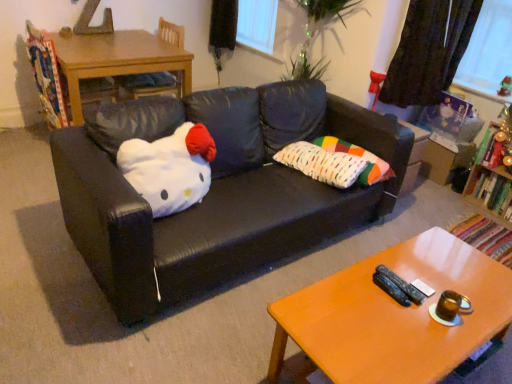
Question: Does orange wood coffee table at lower right have a larger size compared to dark fabric curtain at upper right?

Choices:
 (A) yes
 (B) no

Answer: (A)

Question: Is the position of orange wood coffee table at lower right more distant than that of dark fabric curtain at upper right?

Choices:
 (A) yes
 (B) no

Answer: (B)

Question: Is orange wood coffee table at lower right smaller than dark fabric curtain at upper right?

Choices:
 (A) no
 (B) yes

Answer: (A)

Question: Is orange wood coffee table at lower right not close to dark fabric curtain at upper right?

Choices:
 (A) no
 (B) yes

Answer: (B)

Question: Can you confirm if orange wood coffee table at lower right is taller than dark fabric curtain at upper right?

Choices:
 (A) no
 (B) yes

Answer: (A)

Question: Considering the relative sizes of orange wood coffee table at lower right and dark fabric curtain at upper right in the image provided, is orange wood coffee table at lower right shorter than dark fabric curtain at upper right?

Choices:
 (A) yes
 (B) no

Answer: (A)

Question: Would you say black leather couch at center is a long distance from wooden table at left?

Choices:
 (A) no
 (B) yes

Answer: (B)

Question: From a real-world perspective, is black leather couch at center physically below wooden table at left?

Choices:
 (A) yes
 (B) no

Answer: (B)

Question: Is the depth of black leather couch at center greater than that of wooden table at left?

Choices:
 (A) no
 (B) yes

Answer: (A)

Question: From the image's perspective, is black leather couch at center on top of wooden table at left?

Choices:
 (A) no
 (B) yes

Answer: (A)

Question: Is black leather couch at center positioned beyond the bounds of wooden table at left?

Choices:
 (A) no
 (B) yes

Answer: (B)

Question: Can wooden table at left be found inside black leather couch at center?

Choices:
 (A) no
 (B) yes

Answer: (A)

Question: Is black leather couch at center in front of wooden bookshelf at right?

Choices:
 (A) yes
 (B) no

Answer: (A)